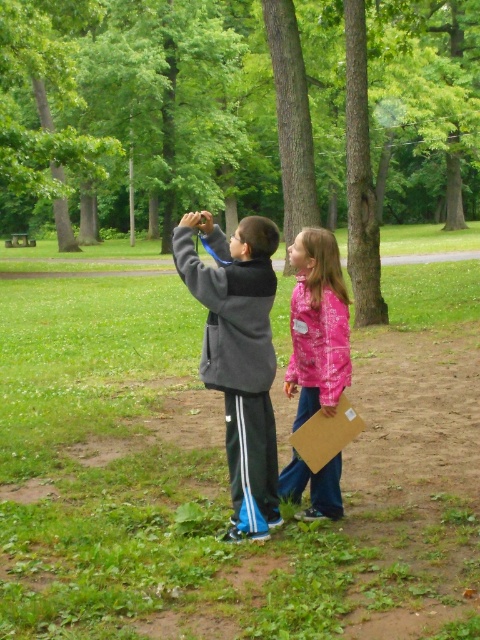
Question: Which point appears farthest from the camera in this image?

Choices:
 (A) (259, 444)
 (B) (312, 244)
 (C) (305, 445)

Answer: (B)

Question: Which is nearer to the gray fleece jacket at center?

Choices:
 (A) brown cardboard at lower center
 (B) pink fabric jacket at lower center

Answer: (A)

Question: Can you confirm if gray fleece jacket at center is positioned below brown cardboard at lower center?

Choices:
 (A) yes
 (B) no

Answer: (B)

Question: Which object appears farthest from the camera in this image?

Choices:
 (A) gray fleece jacket at center
 (B) pink fabric jacket at lower center

Answer: (B)

Question: Is gray fleece jacket at center bigger than brown cardboard at lower center?

Choices:
 (A) no
 (B) yes

Answer: (B)

Question: Can you confirm if pink fabric jacket at lower center is positioned to the left of brown cardboard at lower center?

Choices:
 (A) no
 (B) yes

Answer: (B)